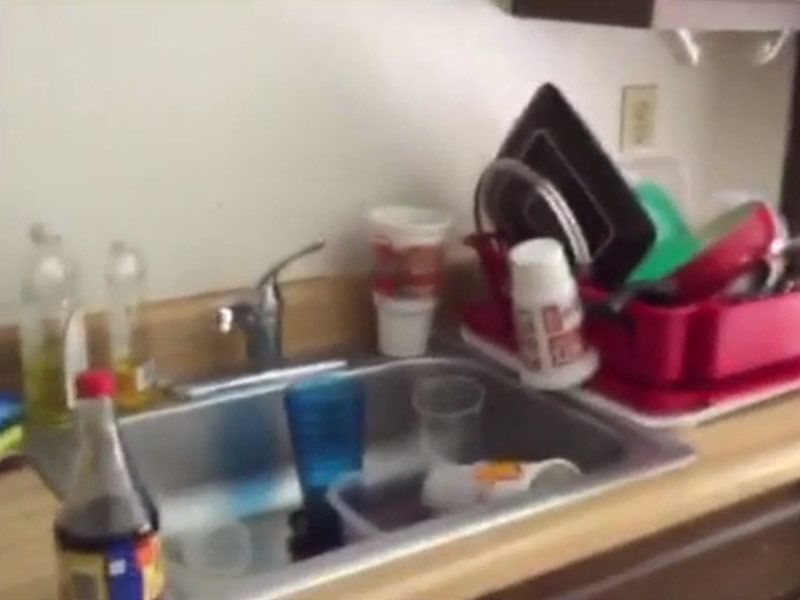
Where is `dish drying rack`? The height and width of the screenshot is (600, 800). dish drying rack is located at coordinates (725, 338).